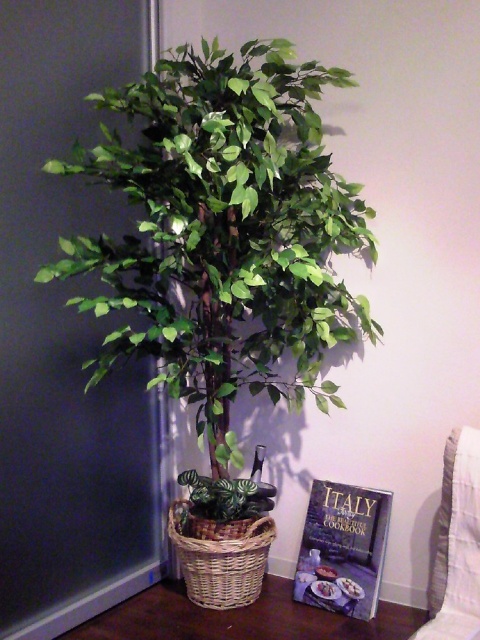
Who is shorter, green leafy tree at center or hardcover cookbook at lower right?

Standing shorter between the two is hardcover cookbook at lower right.

Does green leafy tree at center have a lesser height compared to hardcover cookbook at lower right?

Incorrect, green leafy tree at center's height does not fall short of hardcover cookbook at lower right's.

Locate an element on the screen. The width and height of the screenshot is (480, 640). green leafy tree at center is located at coordinates (225, 230).

Find the location of a particular element. green leafy tree at center is located at coordinates (225, 230).

Is brown wicker basket at lower center taller than hardcover cookbook at lower right?

In fact, brown wicker basket at lower center may be shorter than hardcover cookbook at lower right.

Between point (104, 620) and point (363, 544), which one is positioned in front?

Point (104, 620) is more forward.

You are a GUI agent. You are given a task and a screenshot of the screen. Output one action in this format:
    pyautogui.click(x=<x>, y=<y>)
    Task: Click on the brown wicker basket at lower center
    The width and height of the screenshot is (480, 640).
    Given the screenshot: What is the action you would take?
    pyautogui.click(x=240, y=618)

Does green leafy tree at center appear on the right side of woven brown basket at center?

Incorrect, green leafy tree at center is not on the right side of woven brown basket at center.

Is point (337, 180) positioned in front of point (235, 577)?

No, it is behind (235, 577).

Who is more distant from viewer, (171, 262) or (268, 538)?

The point (268, 538) is behind.

Where is `green leafy tree at center`? The width and height of the screenshot is (480, 640). green leafy tree at center is located at coordinates (225, 230).